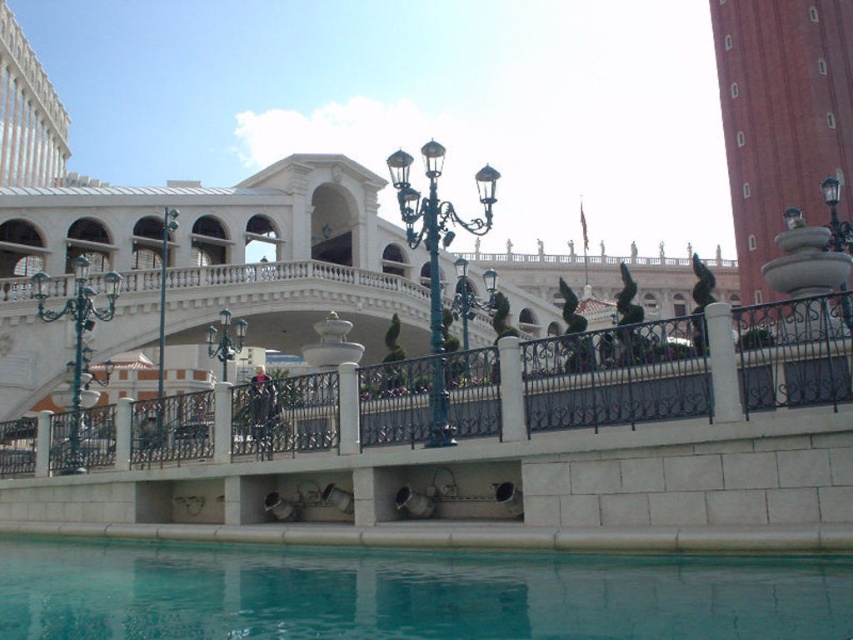
Does clear glass pool at lower center appear over black wrought iron railing at center?

No.

Describe the element at coordinates (408, 593) in the screenshot. I see `clear glass pool at lower center` at that location.

Locate an element on the screen. This screenshot has width=853, height=640. clear glass pool at lower center is located at coordinates (408, 593).

Is clear glass pool at lower center closer to the viewer compared to white stone pillar at center?

Yes, clear glass pool at lower center is in front of white stone pillar at center.

What are the coordinates of `clear glass pool at lower center` in the screenshot? It's located at (408, 593).

Find the location of a particular element. The height and width of the screenshot is (640, 853). clear glass pool at lower center is located at coordinates (408, 593).

Does black wrought iron railing at center appear on the left side of white stone pillar at center?

Correct, you'll find black wrought iron railing at center to the left of white stone pillar at center.

Can you confirm if black wrought iron railing at center is shorter than white stone pillar at center?

No.

Identify the location of black wrought iron railing at center. (618, 376).